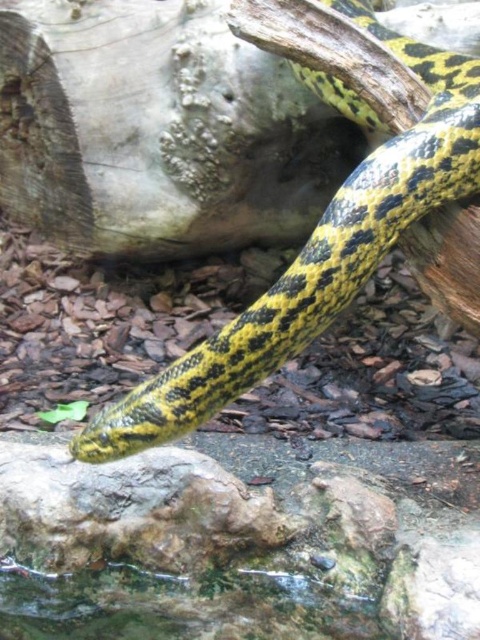
Question: Can you confirm if yellow-green scales at lower center is thinner than green rough rock at center?

Choices:
 (A) yes
 (B) no

Answer: (B)

Question: Can you confirm if yellow-green scales at lower center is smaller than green rough rock at center?

Choices:
 (A) yes
 (B) no

Answer: (B)

Question: Is yellow-green scales at lower center bigger than green rough rock at center?

Choices:
 (A) yes
 (B) no

Answer: (A)